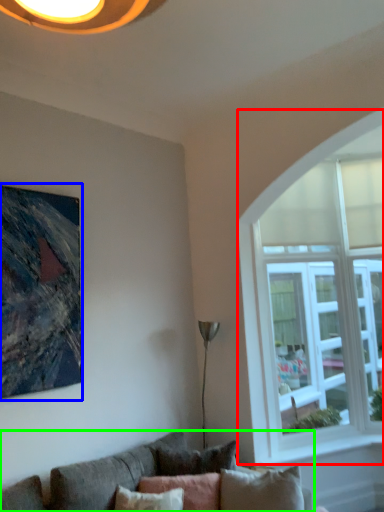
Question: Based on their relative distances, which object is nearer to window (highlighted by a red box)? Choose from picture frame (highlighted by a blue box) and studio couch (highlighted by a green box).

Choices:
 (A) picture frame
 (B) studio couch

Answer: (B)